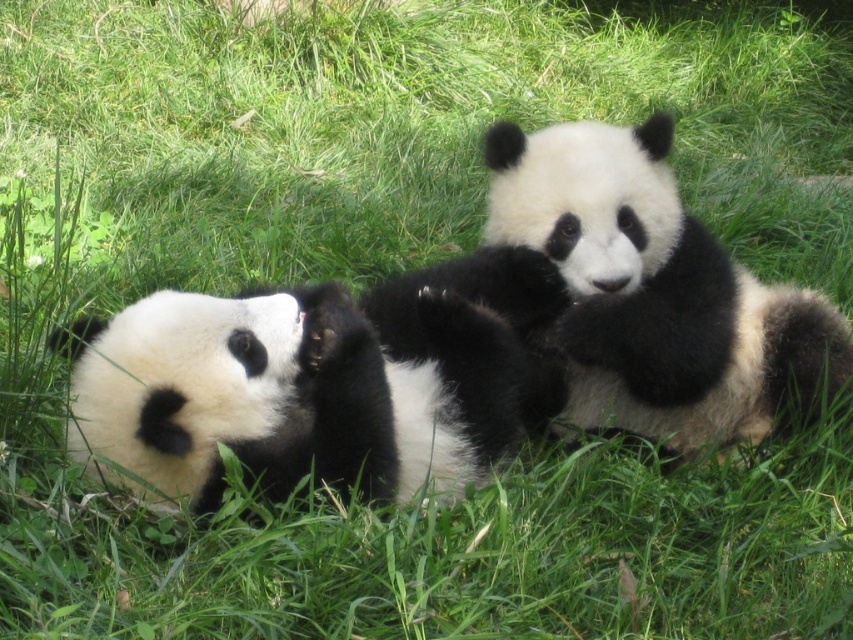
You are a zookeeper observing two pandas in their enclosure. You notice the soft fur panda at center and the soft fur panda at left. Which panda would cast a bigger shadow if the sun is directly overhead?

The soft fur panda at center has a larger size compared to the soft fur panda at left, so it would cast a bigger shadow.

You are a zookeeper who needs to place a feeding bowl between the two soft fur pandas. The bowl has a diameter of 30 centimeters. Will there be enough space between the soft fur panda at center and the soft fur panda at left to place the bowl?

The soft fur panda at center and the soft fur panda at left are 40.00 centimeters apart. Since the bowl requires 30 centimeters of space, there is enough room to place it between them.